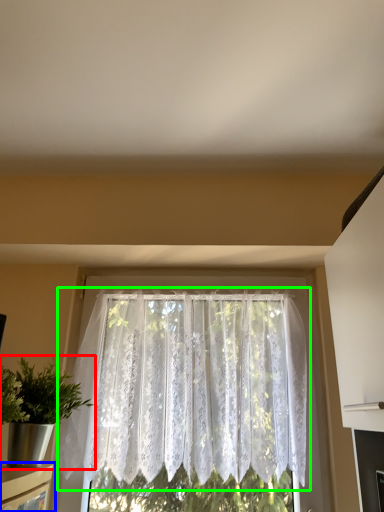
Question: Which is nearer to the houseplant (highlighted by a red box)? shelf (highlighted by a blue box) or window (highlighted by a green box).

Choices:
 (A) shelf
 (B) window

Answer: (A)